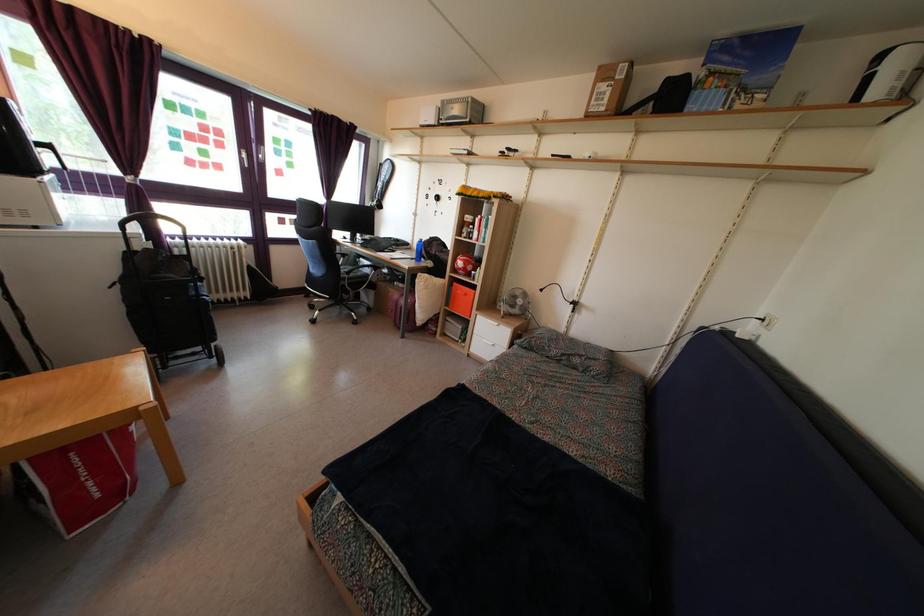
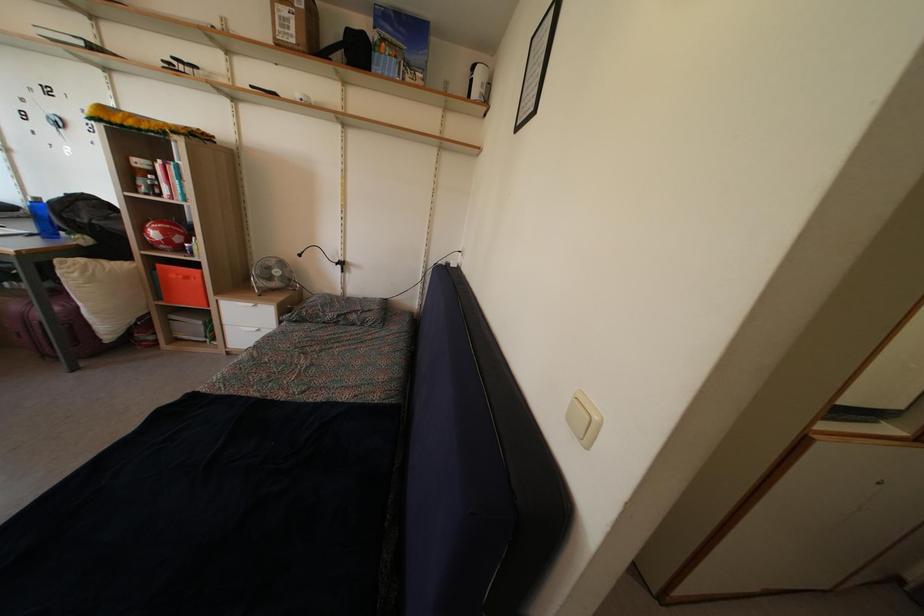
Find the pixel in the second image that matches pixel 605 118 in the first image.

(296, 50)